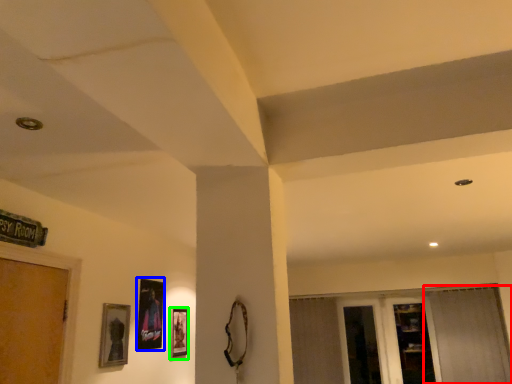
Question: Based on their relative distances, which object is nearer to curtain (highlighted by a red box)? Choose from picture frame (highlighted by a blue box) and picture frame (highlighted by a green box).

Choices:
 (A) picture frame
 (B) picture frame

Answer: (B)